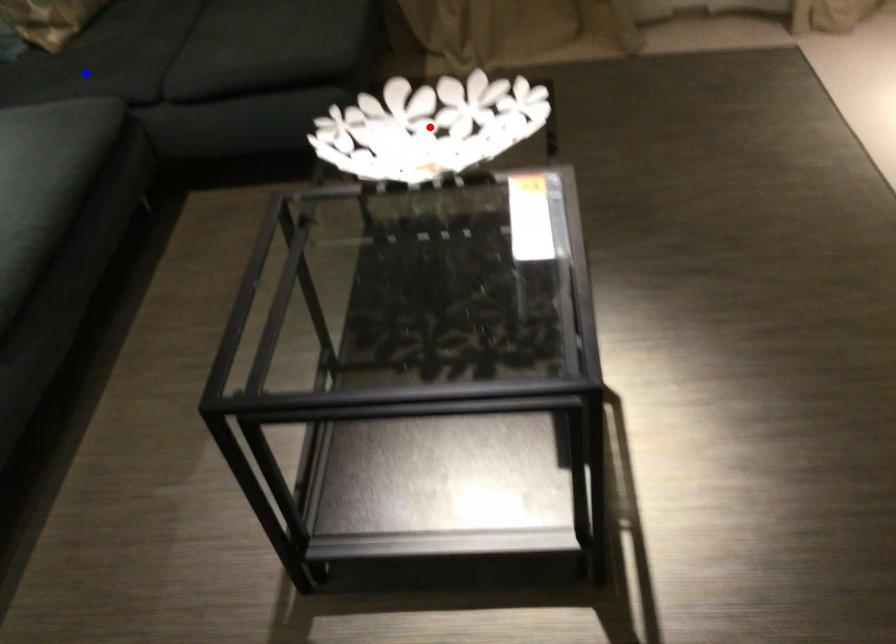
Question: In the image, two points are highlighted. Which point is nearer to the camera? Reply with the corresponding letter.

Choices:
 (A) blue point
 (B) red point

Answer: (B)